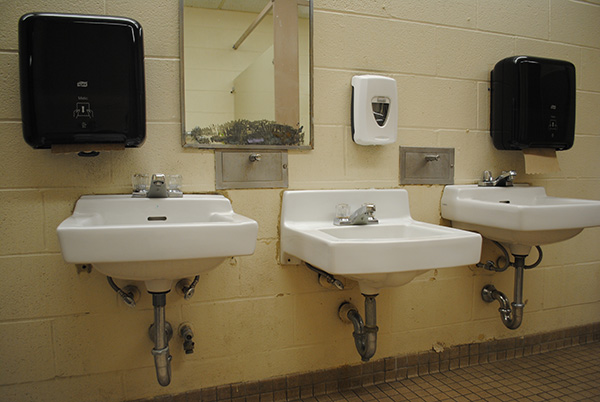
Find the location of a particular element. light gray sides of sinks is located at coordinates (178, 244), (394, 260), (536, 220).